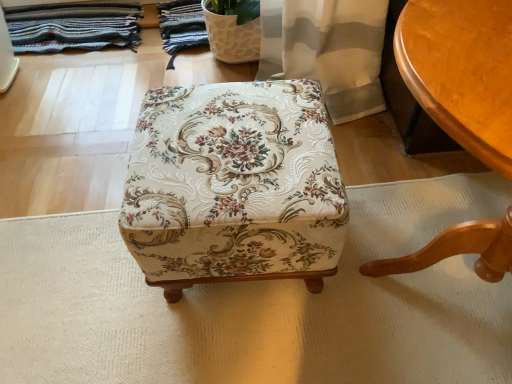
Question: Is smooth wooden table at right taller or shorter than striped woolen blanket at upper left?

Choices:
 (A) tall
 (B) short

Answer: (A)

Question: From the image's perspective, is smooth wooden table at right located above or below striped woolen blanket at upper left?

Choices:
 (A) above
 (B) below

Answer: (B)

Question: Which object is the farthest from the striped woolen blanket at upper left?

Choices:
 (A) smooth wooden table at right
 (B) floral fabric ottoman at center

Answer: (A)

Question: Which of these objects is positioned closest to the striped woolen blanket at upper left?

Choices:
 (A) floral fabric ottoman at center
 (B) smooth wooden table at right

Answer: (A)